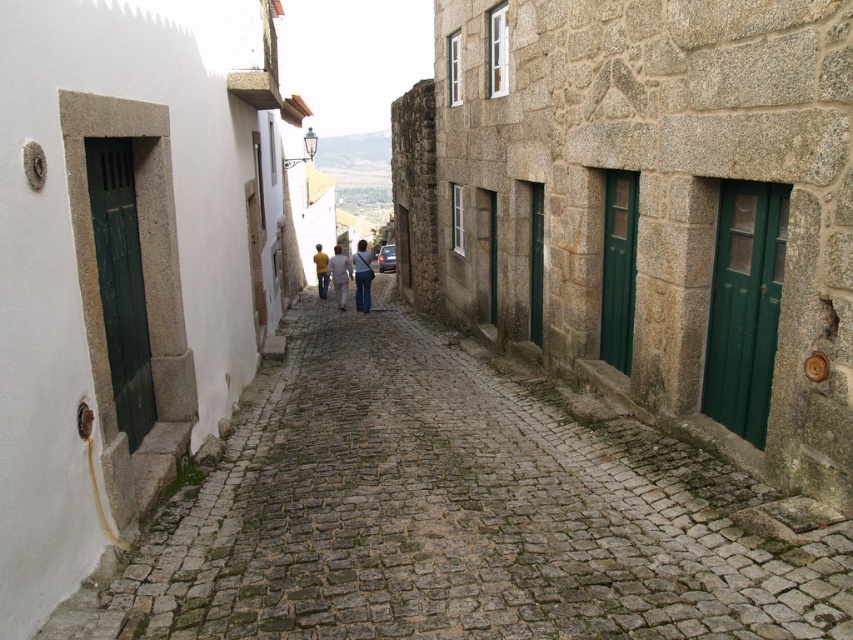
From the picture: You are standing on the brown cobblestone path at center and want to walk towards the yellow matte shirt at center. Is there enough space for you to walk straight ahead without stepping off the path?

The brown cobblestone path at center might be wider than yellow matte shirt at center, so there is a possibility that the path is wide enough to walk straight ahead without stepping off. However, the exact width is uncertain based on the given information.

You are standing on a narrow cobblestone street with traditional stone buildings. You see a light yellow sweater at center. Where is the light yellow sweater positioned relative to the center of the street?

The light yellow sweater at center is located exactly at the center of the street, at coordinates point (339, 275).

You are standing at the starting point of the cobblestone street and want to reach a destination located at point (361,244). There is an obstacle at point (802,616) blocking your path. Can you walk directly towards your destination without going around the obstacle?

Point (802,616) is in front of point (361,244), so the obstacle is between you and your destination. You will need to go around it to reach your destination.